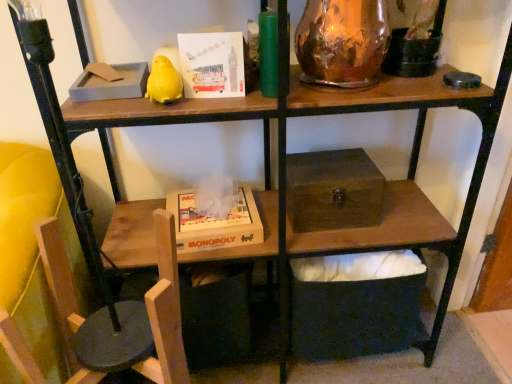
Question: Considering the relative positions of matte paper card at upper center and wooden box at center, placed as the second box when sorted from top to bottom, in the image provided, is matte paper card at upper center to the left or to the right of wooden box at center, placed as the second box when sorted from top to bottom,?

Choices:
 (A) right
 (B) left

Answer: (B)

Question: Is matte paper card at upper center inside or outside of wooden box at center, acting as the first box starting from the bottom?

Choices:
 (A) inside
 (B) outside

Answer: (B)

Question: Considering the real-world distances, which object is closest to the brown wooden box at center, arranged as the 2th box when ordered from the bottom?

Choices:
 (A) wooden swivel chair at lower left
 (B) matte paper card at upper center
 (C) copper metallic vase at upper right
 (D) wooden monopoly game at lower center
 (E) wooden box at center, acting as the first box starting from the bottom

Answer: (E)

Question: Based on their relative distances, which object is farther from the matte paper card at upper center?

Choices:
 (A) copper metallic vase at upper right
 (B) brown wooden box at center, arranged as the 2th box when ordered from the bottom
 (C) wooden monopoly game at lower center
 (D) wooden chair at lower left
 (E) wooden box at center, acting as the first box starting from the bottom

Answer: (E)